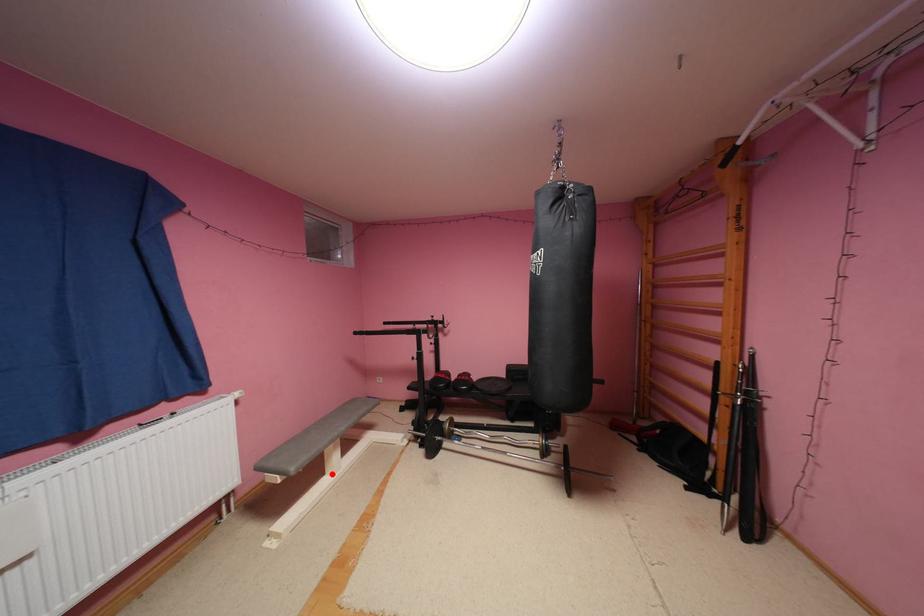
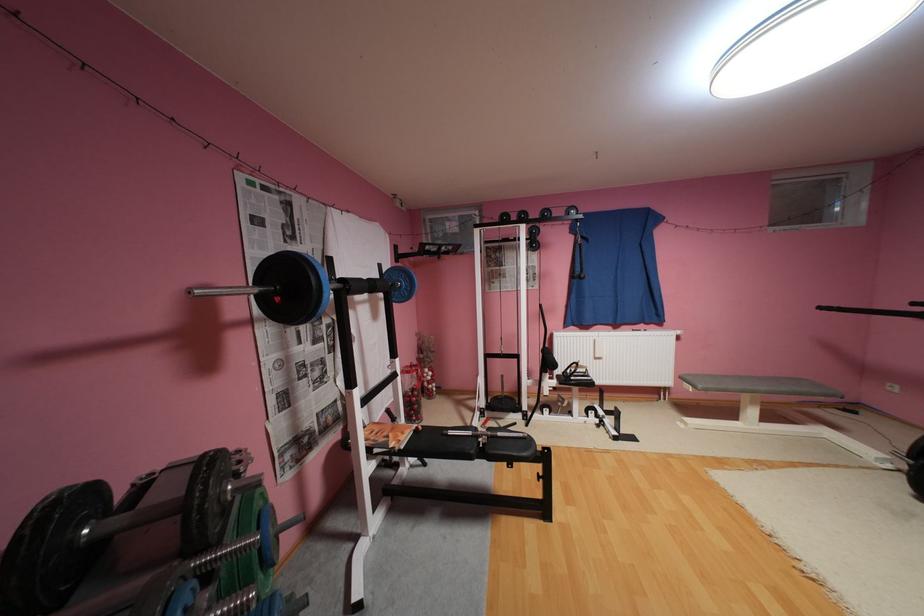
Question: I am providing you with two images of the same scene from different viewpoints. A red point is marked on the first image. Can you still see the location of the red point in image 2?

Choices:
 (A) Yes
 (B) No

Answer: (A)